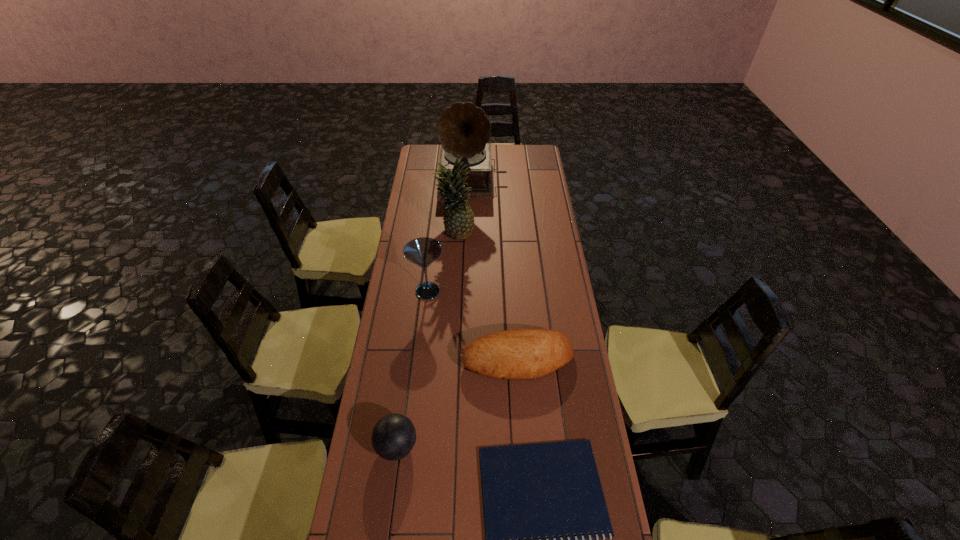
Locate an element on the screen. vacant space situated 0.370m on the back of the third tallest object is located at coordinates (435, 224).

This screenshot has width=960, height=540. What are the coordinates of `vacant space positioned on the grip area of the bowling ball` in the screenshot? It's located at (444, 446).

I want to click on blank space located on the front of the second shortest object, so click(527, 494).

Locate an element on the screen. object that is positioned at the far edge is located at coordinates (463, 129).

This screenshot has width=960, height=540. In order to click on record player that is positioned at the left edge in this screenshot , I will do `click(463, 129)`.

The width and height of the screenshot is (960, 540). I want to click on martini that is at the left edge, so click(423, 251).

Where is `bowling ball positioned at the left edge`? bowling ball positioned at the left edge is located at coordinates (394, 435).

Find the location of a particular element. The height and width of the screenshot is (540, 960). object located at the right edge is located at coordinates (519, 354).

The image size is (960, 540). Identify the location of object present at the far left corner. (463, 129).

Locate an element on the screen. vacant space at the far edge of the desktop is located at coordinates [x=494, y=153].